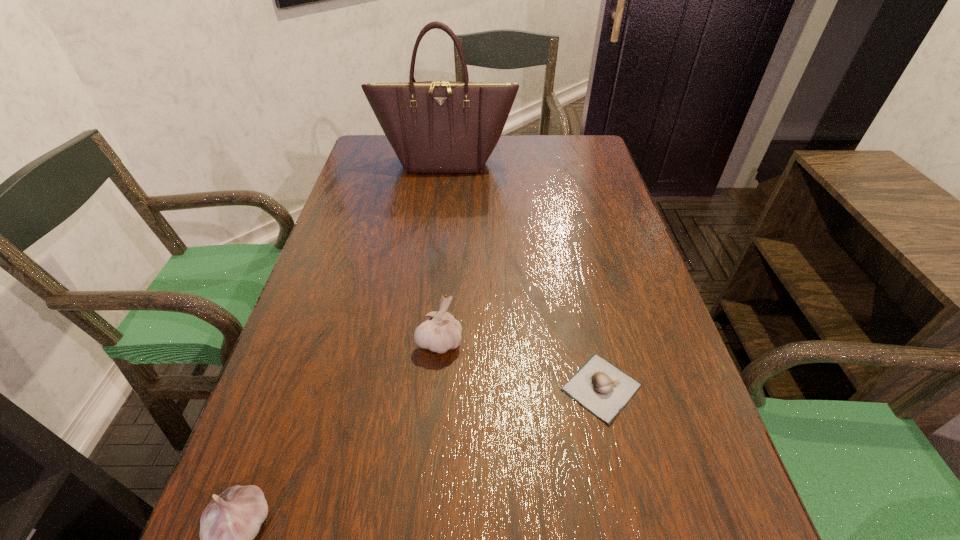
Identify the location of object located at the right edge. This screenshot has height=540, width=960. (602, 388).

Identify the location of object that is positioned at the far left corner. (433, 126).

Find the location of `vacant space at the far edge`. vacant space at the far edge is located at coordinates (520, 147).

Where is `vacant space at the left edge`? vacant space at the left edge is located at coordinates (350, 245).

In the image, there is a desktop. At what (x,y) coordinates should I click in order to perform the action: click on vacant space at the right edge. Please return your answer as a coordinate pair (x, y). The height and width of the screenshot is (540, 960). Looking at the image, I should click on (606, 255).

Locate an element on the screen. Image resolution: width=960 pixels, height=540 pixels. free space at the far right corner of the desktop is located at coordinates (553, 147).

Identify the location of free space between the farthest object and the second garlic from left to right. This screenshot has width=960, height=540. (443, 252).

Locate an element on the screen. This screenshot has height=540, width=960. unoccupied area between the second garlic from left to right and the handbag is located at coordinates (443, 252).

The width and height of the screenshot is (960, 540). In order to click on vacant area that lies between the second garlic from right to left and the rightmost garlic in this screenshot , I will do `click(520, 364)`.

The width and height of the screenshot is (960, 540). What are the coordinates of `vacant space that is in between the second garlic from right to left and the shortest object` in the screenshot? It's located at (520, 364).